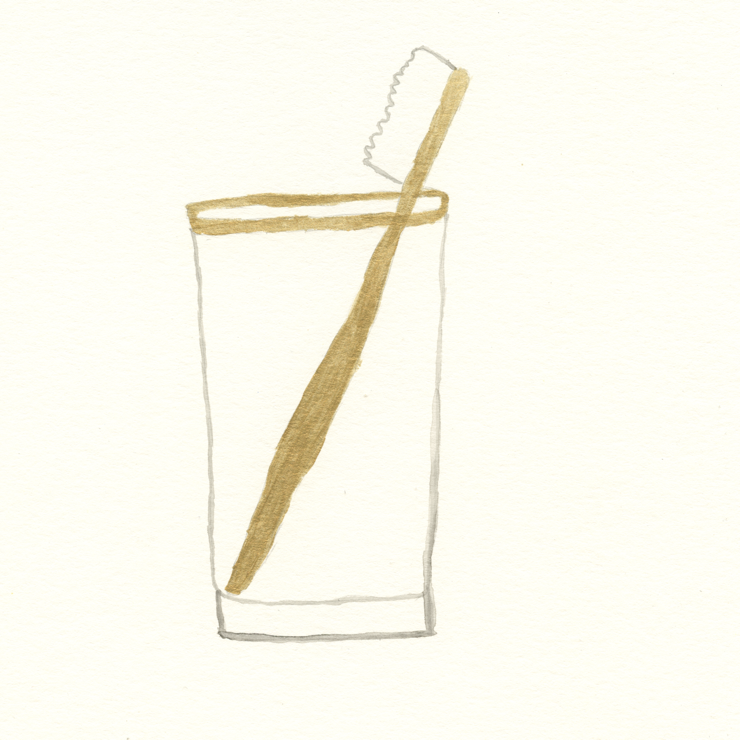
Where is `upper rim of cup`? upper rim of cup is located at coordinates 257,223.